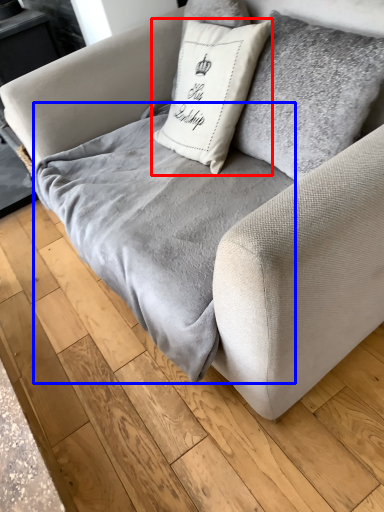
Question: Which object is further to the camera taking this photo, pillow (highlighted by a red box) or blanket (highlighted by a blue box)?

Choices:
 (A) pillow
 (B) blanket

Answer: (A)